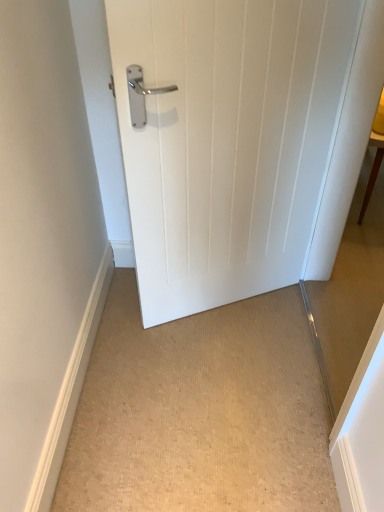
Consider the image. Measure the distance between white matte door at center and camera.

They are 1.04 meters apart.

At what (x,y) coordinates should I click in order to perform the action: click on white matte door at center. Please return your answer as a coordinate pair (x, y). Image resolution: width=384 pixels, height=512 pixels. Looking at the image, I should click on (227, 141).

Describe the element at coordinates (227, 141) in the screenshot. I see `white matte door at center` at that location.

You are a GUI agent. You are given a task and a screenshot of the screen. Output one action in this format:
    pyautogui.click(x=<x>, y=<y>)
    Task: Click on the white matte door at center
    The width and height of the screenshot is (384, 512).
    Given the screenshot: What is the action you would take?
    pyautogui.click(x=227, y=141)